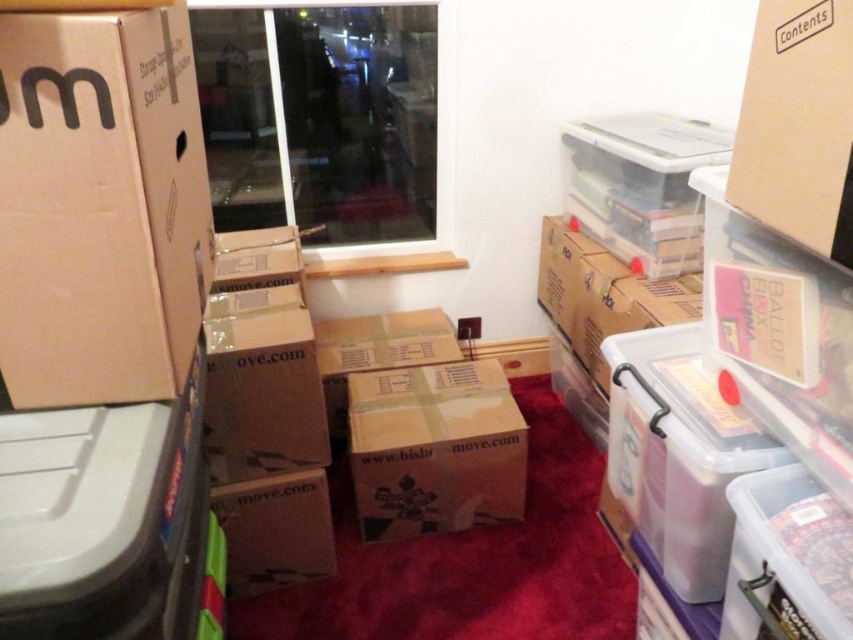
You are trying to fit the matte cardboard box at left and the brown cardboard box at center into a storage space that can only accommodate items narrower than 30 centimeters. Based on their widths, which box might not fit?

The brown cardboard box at center has a greater width than the matte cardboard box at left, so it might not fit in the storage space if it exceeds 30 centimeters.

From the picture: You are trying to stack more boxes on top of the existing ones in the storage area. Based on their heights, which box, the matte cardboard box at left or the brown cardboard box at center, would be more stable to place additional boxes on?

The matte cardboard box at left has a greater height compared to the brown cardboard box at center, so placing additional boxes on the matte cardboard box at left would be more stable due to its taller structure providing a more secure base.

Looking at this image, you are a delivery person standing in front of the storage area. You need to place a new package that is 25 inches long. Can you fit it between you and the matte cardboard box at left without moving anything?

The distance between you and the matte cardboard box at left is 25.15 inches. Since the package is 25 inches long, it will fit with a small amount of space remaining.